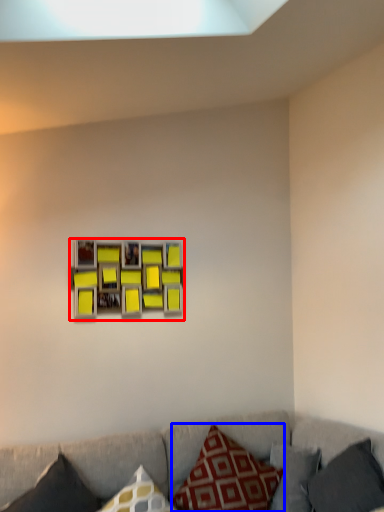
Question: Which of the following is the closest to the observer, picture frame (highlighted by a red box) or pillow (highlighted by a blue box)?

Choices:
 (A) picture frame
 (B) pillow

Answer: (B)